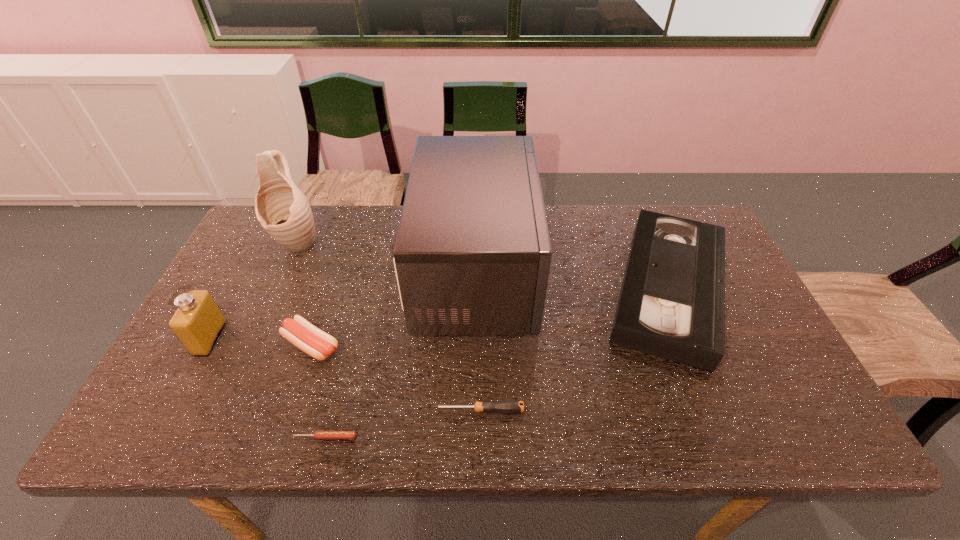
At what (x,y) coordinates should I click in order to perform the action: click on vacant position in the image that satisfies the following two spatial constraints: 1. at the spout of the taller sausage; 2. on the right side of the pitcher. Please return your answer as a coordinate pair (x, y). Image resolution: width=960 pixels, height=540 pixels. Looking at the image, I should click on (252, 345).